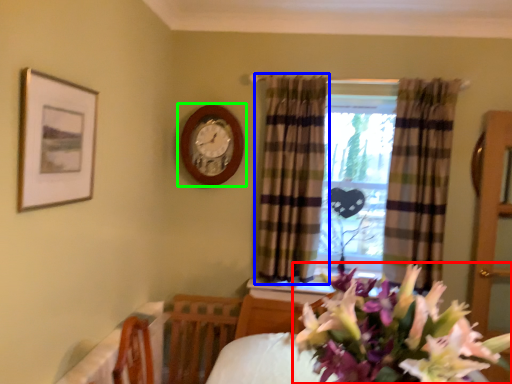
Question: Considering the real-world distances, which object is closest to flower (highlighted by a red box)? curtain (highlighted by a blue box) or wall clock (highlighted by a green box).

Choices:
 (A) curtain
 (B) wall clock

Answer: (A)